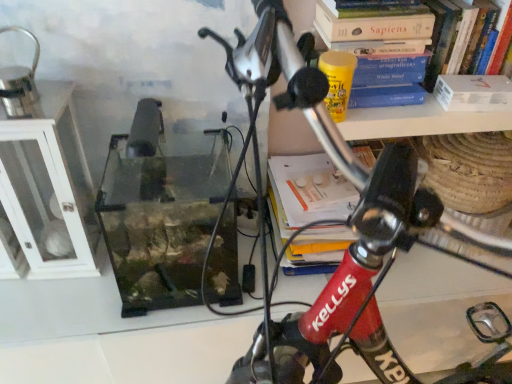
This screenshot has width=512, height=384. Find the location of `vacant space to the right of white glass cabinet at left`. vacant space to the right of white glass cabinet at left is located at coordinates (130, 270).